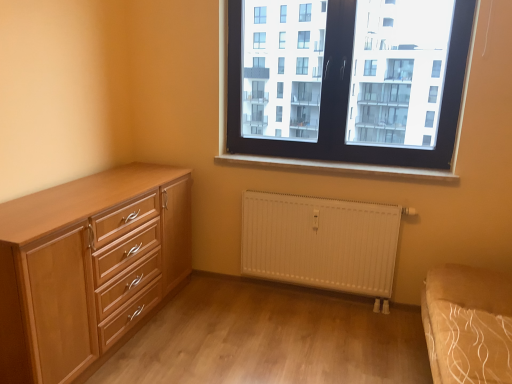
Where is `white painted wood at center`? white painted wood at center is located at coordinates click(x=338, y=167).

What do you see at coordinates (338, 167) in the screenshot?
I see `white painted wood at center` at bounding box center [338, 167].

Where is `black plastic window at upper center`? black plastic window at upper center is located at coordinates (347, 83).

How far apart are white matte radiator at lower center and white painted wood at center?

white matte radiator at lower center and white painted wood at center are 17.50 inches apart from each other.

Which is correct: white matte radiator at lower center is inside white painted wood at center, or outside of it?

white matte radiator at lower center lies outside white painted wood at center.

Looking at this image, which point is more distant from viewer, (351, 214) or (387, 171)?

Point (351, 214)

In the image, is black plastic window at upper center positioned in front of or behind white painted wood at center?

Clearly, black plastic window at upper center is in front of white painted wood at center.

Between black plastic window at upper center and white painted wood at center, which one appears on the right side from the viewer's perspective?

black plastic window at upper center.

Is black plastic window at upper center not within white painted wood at center?

Absolutely, black plastic window at upper center is external to white painted wood at center.

Where is `window that is above the white painted wood at center (from a real-world perspective)`? This screenshot has width=512, height=384. window that is above the white painted wood at center (from a real-world perspective) is located at coordinates (347, 83).

Is light wood chest of drawers at left bigger than white matte radiator at lower center?

Yes.

From a real-world perspective, which object stands above the other?

light wood chest of drawers at left is physically above.

Is light wood chest of drawers at left taller or shorter than white matte radiator at lower center?

light wood chest of drawers at left is taller than white matte radiator at lower center.

Which object is closer to the camera, light wood chest of drawers at left or white matte radiator at lower center?

light wood chest of drawers at left is closer to the camera.

Is white matte radiator at lower center not close to light wood chest of drawers at left?

That's not correct — white matte radiator at lower center is a little close to light wood chest of drawers at left.

You are a GUI agent. You are given a task and a screenshot of the screen. Output one action in this format:
    pyautogui.click(x=<x>, y=<y>)
    Task: Click on the radiator on the right of light wood chest of drawers at left
    This screenshot has width=512, height=384.
    Given the screenshot: What is the action you would take?
    321,243

Is white matte radiator at lower center facing towards light wood chest of drawers at left?

No, white matte radiator at lower center is not oriented towards light wood chest of drawers at left.

Considering the positions of objects white matte radiator at lower center and light wood chest of drawers at left in the image provided, who is more to the right, white matte radiator at lower center or light wood chest of drawers at left?

white matte radiator at lower center is more to the right.

Can you confirm if white matte radiator at lower center is shorter than black plastic window at upper center?

Yes.

How far apart are white matte radiator at lower center and black plastic window at upper center?

They are 25.66 inches apart.

Would you say white matte radiator at lower center is a long distance from black plastic window at upper center?

No, white matte radiator at lower center is in close proximity to black plastic window at upper center.

Is white matte radiator at lower center thinner than black plastic window at upper center?

Yes.

Is white painted wood at center turned away from light wood chest of drawers at left?

No, white painted wood at center's orientation is not away from light wood chest of drawers at left.

Does white painted wood at center have a lesser height compared to light wood chest of drawers at left?

Yes.

Which is closer, [239,165] or [114,338]?

Point [239,165].

From a real-world perspective, is light wood chest of drawers at left physically located above or below black plastic window at upper center?

light wood chest of drawers at left is below black plastic window at upper center.

Is light wood chest of drawers at left directly adjacent to black plastic window at upper center?

They are not placed beside each other.

Can you confirm if light wood chest of drawers at left is bigger than black plastic window at upper center?

Yes.

Is light wood chest of drawers at left to the left or to the right of black plastic window at upper center in the image?

From the image, it's evident that light wood chest of drawers at left is to the left of black plastic window at upper center.

This screenshot has width=512, height=384. Find the location of `radiator behind the white painted wood at center`. radiator behind the white painted wood at center is located at coordinates (321, 243).

This screenshot has height=384, width=512. What are the coordinates of `window to the right of white painted wood at center` in the screenshot? It's located at (347, 83).

Considering their positions, is black plastic window at upper center positioned further to light wood chest of drawers at left than white matte radiator at lower center?

black plastic window at upper center is positioned further to the anchor light wood chest of drawers at left.

From the image, which object appears to be nearer to white matte radiator at lower center, light wood chest of drawers at left or black plastic window at upper center?

black plastic window at upper center is closer to white matte radiator at lower center.

When comparing their distances from white matte radiator at lower center, does white painted wood at center or light wood chest of drawers at left seem closer?

white painted wood at center.

From the picture: When comparing their distances from light wood chest of drawers at left, does white matte radiator at lower center or black plastic window at upper center seem closer?

white matte radiator at lower center.

Which object lies nearer to the anchor point white matte radiator at lower center, black plastic window at upper center or light wood chest of drawers at left?

Among the two, black plastic window at upper center is located nearer to white matte radiator at lower center.

From the image, which object appears to be farther from white painted wood at center, black plastic window at upper center or white matte radiator at lower center?

black plastic window at upper center lies further to white painted wood at center than the other object.

From the image, which object appears to be nearer to black plastic window at upper center, white painted wood at center or light wood chest of drawers at left?

white painted wood at center is closer to black plastic window at upper center.

When comparing their distances from black plastic window at upper center, does white painted wood at center or white matte radiator at lower center seem closer?

white painted wood at center.

Identify the location of radiator between light wood chest of drawers at left and black plastic window at upper center. The image size is (512, 384). (321, 243).

Find the location of `window sill situated between light wood chest of drawers at left and black plastic window at upper center from left to right`. window sill situated between light wood chest of drawers at left and black plastic window at upper center from left to right is located at coordinates (338, 167).

Find the location of a particular element. This screenshot has width=512, height=384. window sill between black plastic window at upper center and white matte radiator at lower center in the up-down direction is located at coordinates (338, 167).

Find the location of a particular element. The width and height of the screenshot is (512, 384). radiator situated between light wood chest of drawers at left and white painted wood at center from left to right is located at coordinates (321, 243).